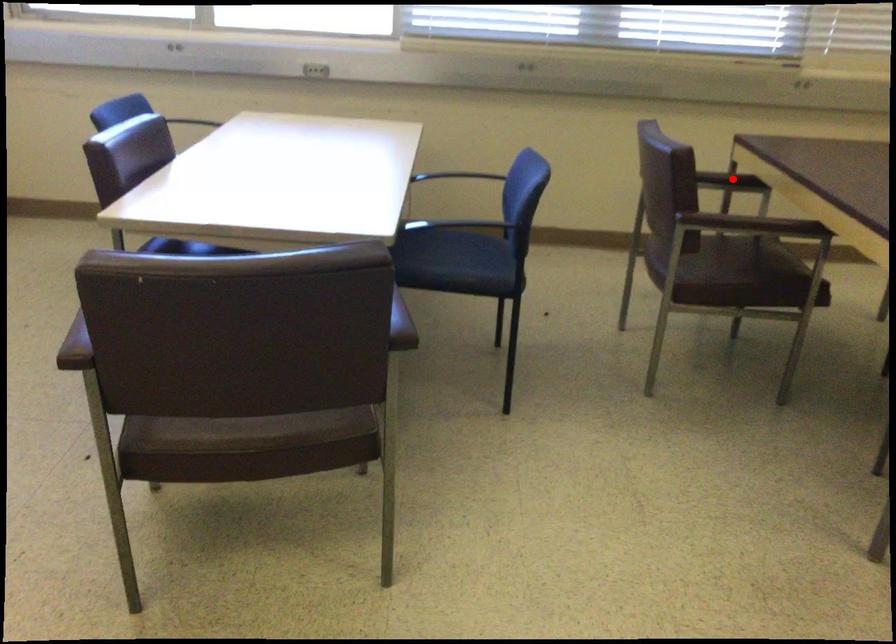
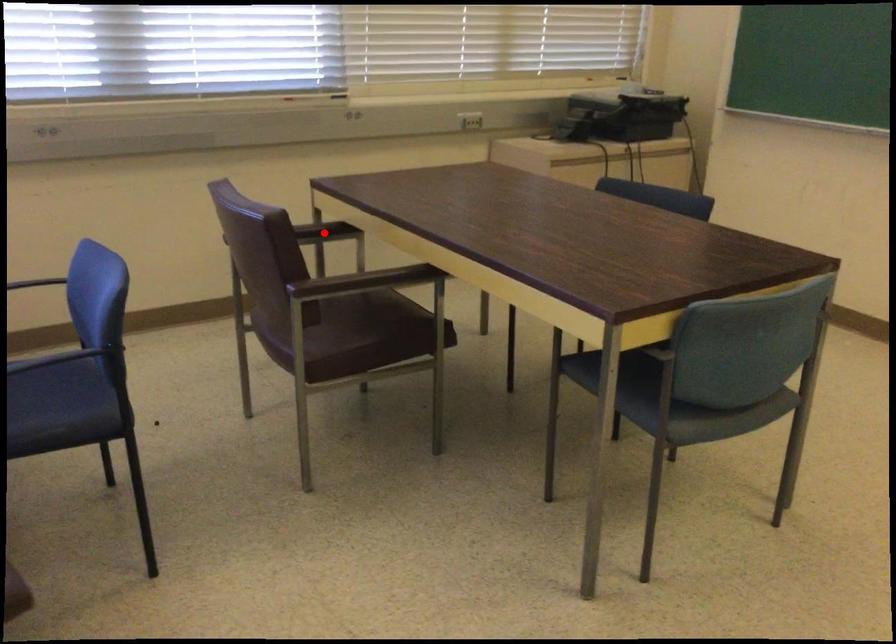
I am providing you with two images of the same scene from different viewpoints. A red point is marked on the first image and another point is marked on the second image. Is the marked point in image1 the same physical position as the marked point in image2?

Yes